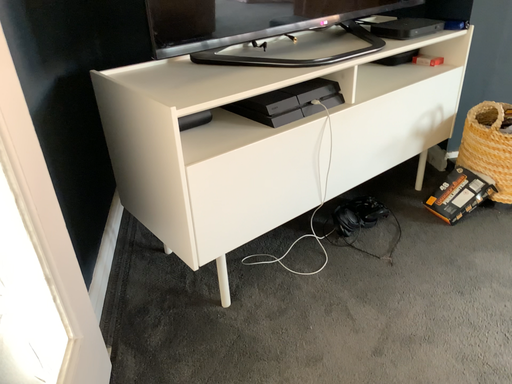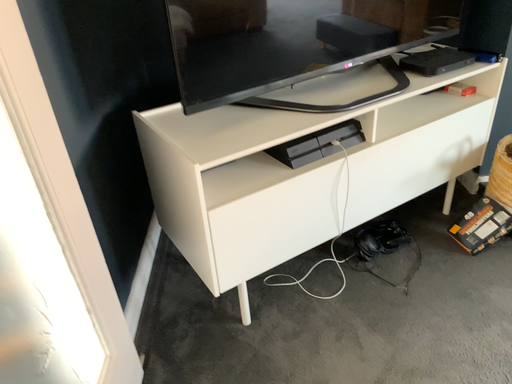
Question: How did the camera likely rotate when shooting the video?

Choices:
 (A) rotated left
 (B) rotated right

Answer: (A)